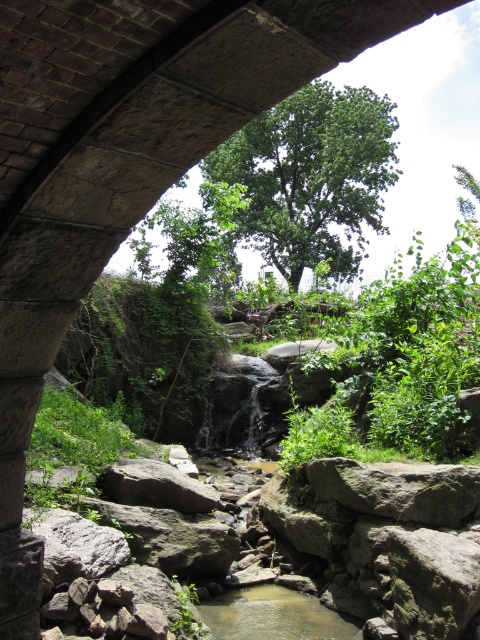
Is green leafy tree at upper center taller than clear water at stream center?

Yes, green leafy tree at upper center is taller than clear water at stream center.

Is green leafy tree at upper center wider than clear water at stream center?

Correct, the width of green leafy tree at upper center exceeds that of clear water at stream center.

Who is more forward, (276, 122) or (287, 621)?

Point (287, 621) is more forward.

The image size is (480, 640). Find the location of `green leafy tree at upper center`. green leafy tree at upper center is located at coordinates (311, 176).